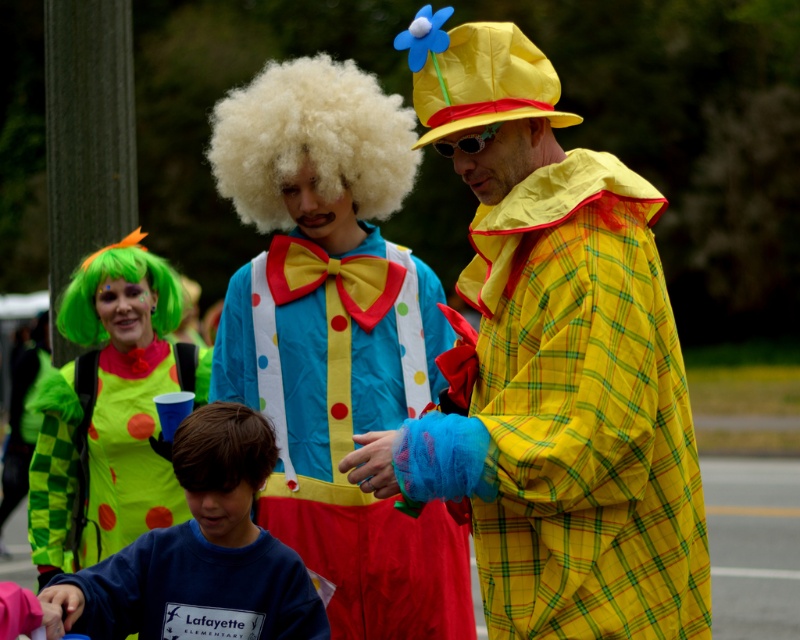
Question: Which point is closer to the camera?

Choices:
 (A) (76, 493)
 (B) (410, 372)
 (C) (84, 266)
 (D) (242, 476)

Answer: (D)

Question: Considering the real-world distances, which object is farthest from the green checkered fabric clown costume at left?

Choices:
 (A) green matte wig at left
 (B) brown synthetic wig at lower center
 (C) polka dot fabric clown suit at center
 (D) yellow plaid coat at center

Answer: (D)

Question: Does fluffy white wig at center appear on the right side of green matte wig at left?

Choices:
 (A) yes
 (B) no

Answer: (A)

Question: Is polka dot fabric clown suit at center to the left of brown synthetic wig at lower center from the viewer's perspective?

Choices:
 (A) yes
 (B) no

Answer: (B)

Question: Which point is closer to the camera taking this photo?

Choices:
 (A) (134, 484)
 (B) (348, 88)

Answer: (B)

Question: Where is green checkered fabric clown costume at left located in relation to brown synthetic wig at lower center in the image?

Choices:
 (A) left
 (B) right

Answer: (A)